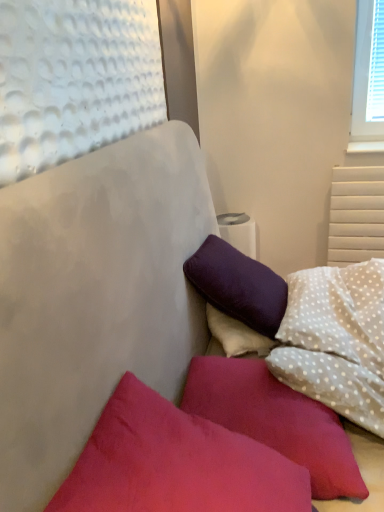
Question: Could you tell me if white dotted fabric pillow at upper right, which is counted as the 1th pillow, starting from the back, is facing suede-like red pillow at lower center, marked as the first pillow in a front-to-back arrangement?

Choices:
 (A) no
 (B) yes

Answer: (A)

Question: Does white dotted fabric pillow at upper right, marked as the 3th pillow in a front-to-back arrangement, appear on the left side of suede-like red pillow at lower center, marked as the first pillow in a front-to-back arrangement?

Choices:
 (A) no
 (B) yes

Answer: (A)

Question: Considering the relative sizes of white dotted fabric pillow at upper right, marked as the 3th pillow in a front-to-back arrangement, and suede-like red pillow at lower center, marked as the first pillow in a front-to-back arrangement, in the image provided, is white dotted fabric pillow at upper right, marked as the 3th pillow in a front-to-back arrangement, taller than suede-like red pillow at lower center, marked as the first pillow in a front-to-back arrangement,?

Choices:
 (A) yes
 (B) no

Answer: (B)

Question: Can you confirm if white dotted fabric pillow at upper right, marked as the 3th pillow in a front-to-back arrangement, is positioned to the right of suede-like red pillow at lower center, marked as the first pillow in a front-to-back arrangement?

Choices:
 (A) yes
 (B) no

Answer: (A)

Question: Considering the relative sizes of white dotted fabric pillow at upper right, marked as the 3th pillow in a front-to-back arrangement, and suede-like red pillow at lower center, marked as the first pillow in a front-to-back arrangement, in the image provided, is white dotted fabric pillow at upper right, marked as the 3th pillow in a front-to-back arrangement, bigger than suede-like red pillow at lower center, marked as the first pillow in a front-to-back arrangement,?

Choices:
 (A) no
 (B) yes

Answer: (B)

Question: Would you say suede-like red pillow at lower center, which is the 3th pillow from back to front, is to the left or to the right of white dotted fabric pillow at upper right, marked as the 3th pillow in a front-to-back arrangement, in the picture?

Choices:
 (A) right
 (B) left

Answer: (B)

Question: From a real-world perspective, is suede-like red pillow at lower center, which is the 3th pillow from back to front, above or below white dotted fabric pillow at upper right, marked as the 3th pillow in a front-to-back arrangement?

Choices:
 (A) above
 (B) below

Answer: (A)

Question: Is point (110, 424) closer or farther from the camera than point (339, 272)?

Choices:
 (A) closer
 (B) farther

Answer: (A)

Question: Is suede-like red pillow at lower center, which is the 3th pillow from back to front, taller or shorter than white dotted fabric pillow at upper right, marked as the 3th pillow in a front-to-back arrangement?

Choices:
 (A) tall
 (B) short

Answer: (A)

Question: From a real-world perspective, is white dotted fabric pillow at upper right, which is counted as the 1th pillow, starting from the back, above or below matte pink pillow at lower left, the 2th pillow positioned from the front?

Choices:
 (A) above
 (B) below

Answer: (A)

Question: Does point (291, 284) appear closer or farther from the camera than point (258, 408)?

Choices:
 (A) farther
 (B) closer

Answer: (A)

Question: Relative to matte pink pillow at lower left, the 2th pillow positioned from the front, is white dotted fabric pillow at upper right, which is counted as the 1th pillow, starting from the back, in front or behind?

Choices:
 (A) behind
 (B) front

Answer: (A)

Question: Would you say white dotted fabric pillow at upper right, which is counted as the 1th pillow, starting from the back, is inside or outside matte pink pillow at lower left, the 2th pillow positioned from the front?

Choices:
 (A) outside
 (B) inside

Answer: (A)

Question: In terms of width, does matte pink pillow at lower left, which is the 2th pillow in back-to-front order, look wider or thinner when compared to suede-like red pillow at lower center, marked as the first pillow in a front-to-back arrangement?

Choices:
 (A) thin
 (B) wide

Answer: (A)

Question: From the image's perspective, is matte pink pillow at lower left, which is the 2th pillow in back-to-front order, above or below suede-like red pillow at lower center, marked as the first pillow in a front-to-back arrangement?

Choices:
 (A) below
 (B) above

Answer: (A)